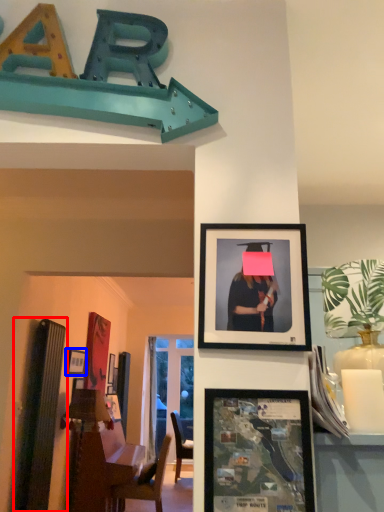
Question: Which object is closer to the camera taking this photo, bulletin board (highlighted by a red box) or picture frame (highlighted by a blue box)?

Choices:
 (A) bulletin board
 (B) picture frame

Answer: (A)